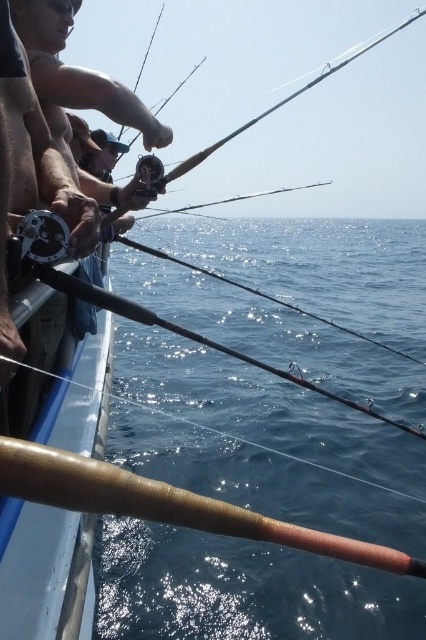
The image size is (426, 640). Describe the element at coordinates (333, 260) in the screenshot. I see `blue water at center` at that location.

Can you confirm if blue water at center is thinner than wooden textured fishing pole at lower left?

No, blue water at center is not thinner than wooden textured fishing pole at lower left.

Does point (42, 582) come in front of point (71, 477)?

No, it is not.

You are a GUI agent. You are given a task and a screenshot of the screen. Output one action in this format:
    pyautogui.click(x=<x>, y=<y>)
    Task: Click on the blue water at center
    
    Given the screenshot: What is the action you would take?
    pyautogui.click(x=333, y=260)

Does brown wood fishing rod at left have a larger size compared to wooden textured fishing pole at lower left?

Indeed, brown wood fishing rod at left has a larger size compared to wooden textured fishing pole at lower left.

Is brown wood fishing rod at left to the left of wooden textured fishing pole at lower left from the viewer's perspective?

Yes, brown wood fishing rod at left is to the left of wooden textured fishing pole at lower left.

Where is `brown wood fishing rod at left`? This screenshot has height=640, width=426. brown wood fishing rod at left is located at coordinates (34, 568).

I want to click on brown wood fishing rod at left, so click(x=34, y=568).

Between brown wood fishing rod at left and blue water at center, which one is positioned lower?

Positioned lower is brown wood fishing rod at left.

Is brown wood fishing rod at left above blue water at center?

Incorrect, brown wood fishing rod at left is not positioned above blue water at center.

In order to click on brown wood fishing rod at left in this screenshot , I will do `click(34, 568)`.